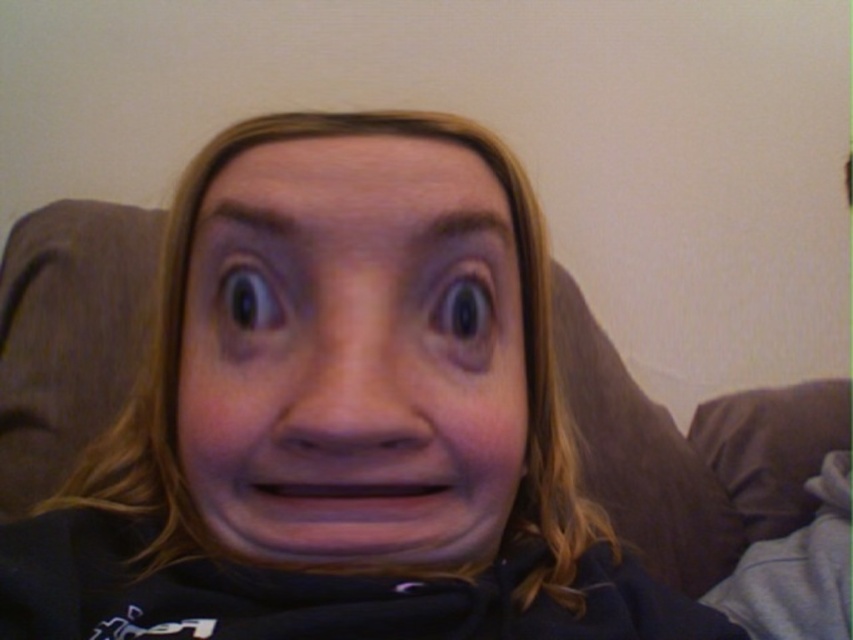
Question: Which of the following is the closest to the observer?

Choices:
 (A) smooth skin face at center
 (B) matte black face at center

Answer: (B)

Question: Which object is the closest to the black glossy eye at upper left?

Choices:
 (A) matte black face at center
 (B) smooth skin face at center
 (C) shiny brown eye at center

Answer: (B)

Question: Does shiny brown eye at center appear on the right side of black glossy eye at upper left?

Choices:
 (A) yes
 (B) no

Answer: (A)

Question: Does shiny brown eye at center lie behind black glossy eye at upper left?

Choices:
 (A) no
 (B) yes

Answer: (B)

Question: Which object appears closest to the camera in this image?

Choices:
 (A) black glossy eye at upper left
 (B) matte black face at center

Answer: (B)

Question: Is smooth skin face at center to the left of black glossy eye at upper left from the viewer's perspective?

Choices:
 (A) yes
 (B) no

Answer: (B)